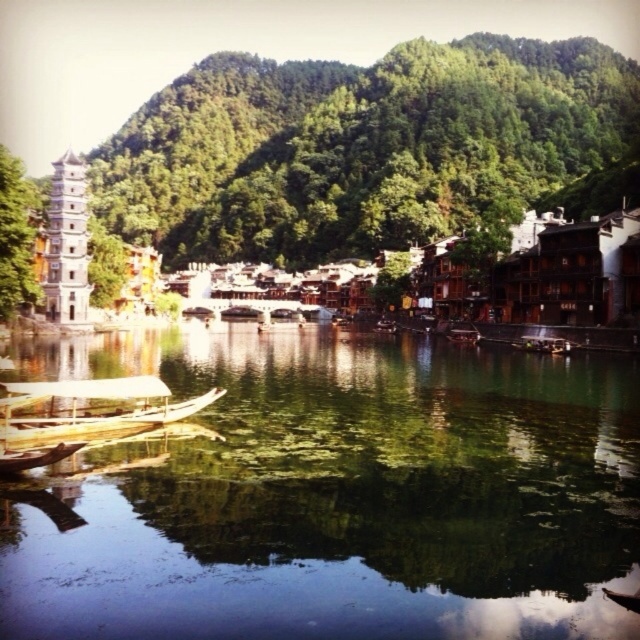
What do you see at coordinates (339, 496) in the screenshot? I see `green reflective water at center` at bounding box center [339, 496].

Which is in front, point (595, 392) or point (448, 216)?

Point (595, 392) is more forward.

Which is in front, point (401, 618) or point (356, 145)?

Point (401, 618) is more forward.

Identify the location of green reflective water at center. (339, 496).

Which is below, wooden boat at lower left or wooden boat at center?

Positioned lower is wooden boat at lower left.

Does wooden boat at lower left have a smaller size compared to wooden boat at center?

No.

Image resolution: width=640 pixels, height=640 pixels. Identify the location of wooden boat at lower left. (84, 416).

Can you confirm if white stone tower at left is positioned to the left of wooden boat at center?

Correct, you'll find white stone tower at left to the left of wooden boat at center.

Can you confirm if white stone tower at left is positioned below wooden boat at center?

No, white stone tower at left is not below wooden boat at center.

Is point (490, 291) closer to viewer compared to point (474, 332)?

No.

I want to click on white stone tower at left, so click(x=547, y=282).